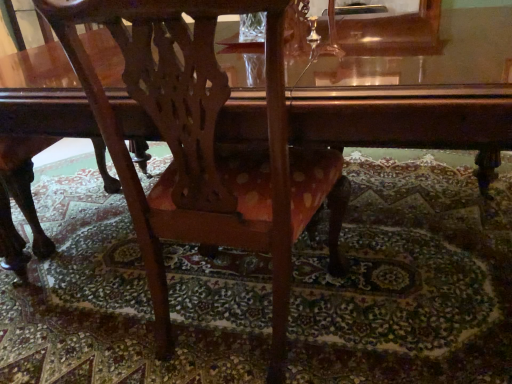
Question: Can you confirm if matte wood chair at center is taller than glossy wood table at center?

Choices:
 (A) no
 (B) yes

Answer: (B)

Question: Can you see matte wood chair at center touching glossy wood table at center?

Choices:
 (A) yes
 (B) no

Answer: (B)

Question: From a real-world perspective, does matte wood chair at center stand above glossy wood table at center?

Choices:
 (A) no
 (B) yes

Answer: (B)

Question: Could you tell me if matte wood chair at center is turned towards glossy wood table at center?

Choices:
 (A) yes
 (B) no

Answer: (A)

Question: Does matte wood chair at center appear on the right side of glossy wood table at center?

Choices:
 (A) no
 (B) yes

Answer: (A)

Question: Is matte wood chair at center outside glossy wood table at center?

Choices:
 (A) no
 (B) yes

Answer: (A)

Question: From the image's perspective, is glossy wood table at center under matte wood chair at center?

Choices:
 (A) no
 (B) yes

Answer: (A)

Question: From the image's perspective, is glossy wood table at center located above matte wood chair at center?

Choices:
 (A) no
 (B) yes

Answer: (B)

Question: Considering the relative sizes of glossy wood table at center and matte wood chair at center in the image provided, is glossy wood table at center taller than matte wood chair at center?

Choices:
 (A) no
 (B) yes

Answer: (A)

Question: Is glossy wood table at center not within matte wood chair at center?

Choices:
 (A) yes
 (B) no

Answer: (A)

Question: Is glossy wood table at center far from matte wood chair at center?

Choices:
 (A) yes
 (B) no

Answer: (B)

Question: Is glossy wood table at center facing towards matte wood chair at center?

Choices:
 (A) no
 (B) yes

Answer: (B)

Question: Is matte wood chair at center wider or thinner than glossy wood table at center?

Choices:
 (A) wide
 (B) thin

Answer: (B)